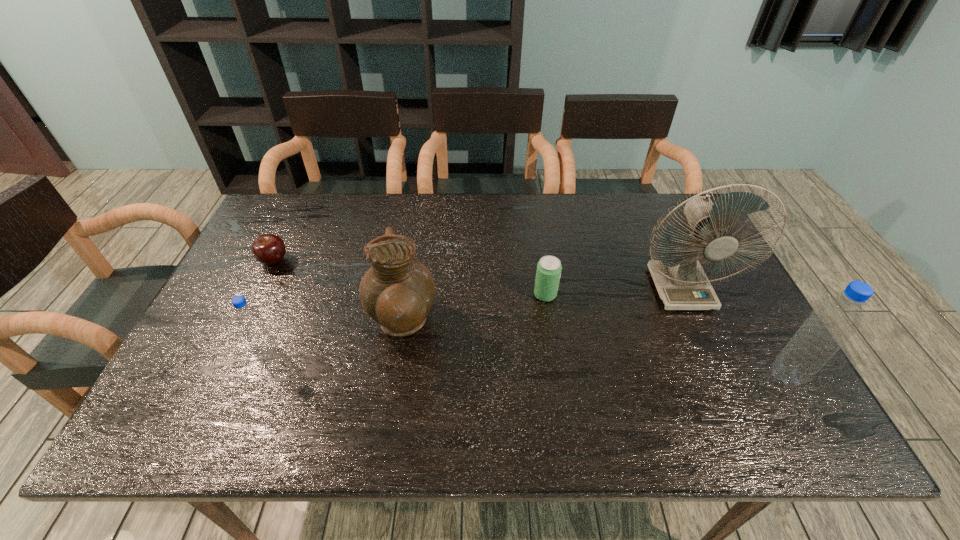
Identify the location of free point located on the back of the taller water bottle. (757, 325).

What are the coordinates of `blank space located 0.060m on the right of the leftmost object` in the screenshot? It's located at (310, 261).

Locate an element on the screen. The image size is (960, 540). vacant space situated 0.070m on the left of the third object from right to left is located at coordinates (508, 295).

Identify the location of vacant point located 0.140m on the front-facing side of the tallest object. (711, 358).

At what (x,y) coordinates should I click in order to perform the action: click on vacant area situated at the spout of the fourth object from right to left. Please return your answer as a coordinate pair (x, y). This screenshot has width=960, height=540. Looking at the image, I should click on (539, 325).

This screenshot has height=540, width=960. Find the location of `object that is at the near edge`. object that is at the near edge is located at coordinates (830, 324).

Locate an element on the screen. The image size is (960, 540). object situated at the left edge is located at coordinates (269, 249).

Identify the location of water bottle situated at the right edge. The height and width of the screenshot is (540, 960). (830, 324).

Where is `fan present at the right edge`? fan present at the right edge is located at coordinates (680, 280).

The height and width of the screenshot is (540, 960). I want to click on object that is positioned at the near right corner, so click(830, 324).